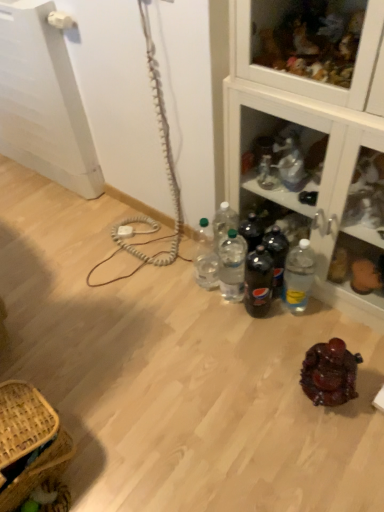
Identify the location of free space to the left of clear plastic bottle at lower right, which appears as the 1th bottle when viewed from the right. (257, 323).